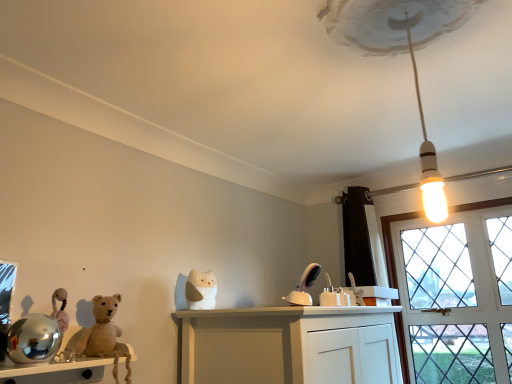
The width and height of the screenshot is (512, 384). I want to click on free spot above wooden shelf at lower left (from a real-world perspective), so click(x=62, y=347).